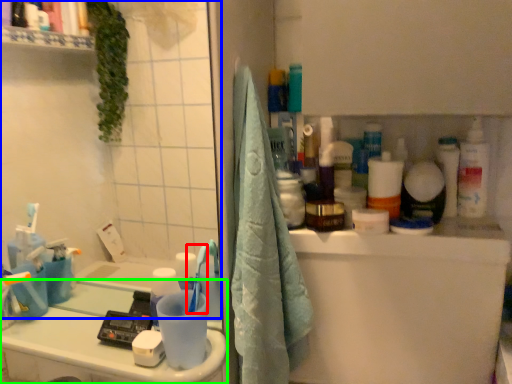
Question: Based on their relative distances, which object is nearer to toothbrush (highlighted by a red box)? Choose from mirror (highlighted by a blue box) and counter top (highlighted by a green box).

Choices:
 (A) mirror
 (B) counter top

Answer: (B)